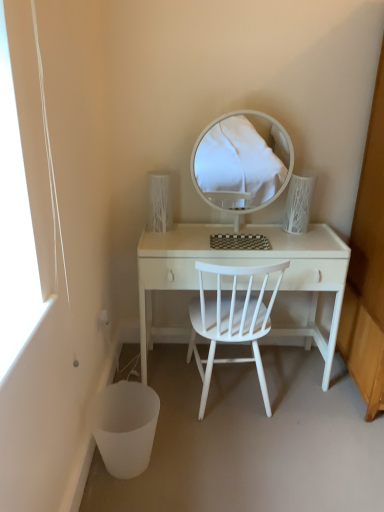
Where is `vacant space situated above white wood desk at center (from a real-world perspective)`? The height and width of the screenshot is (512, 384). vacant space situated above white wood desk at center (from a real-world perspective) is located at coordinates (245, 234).